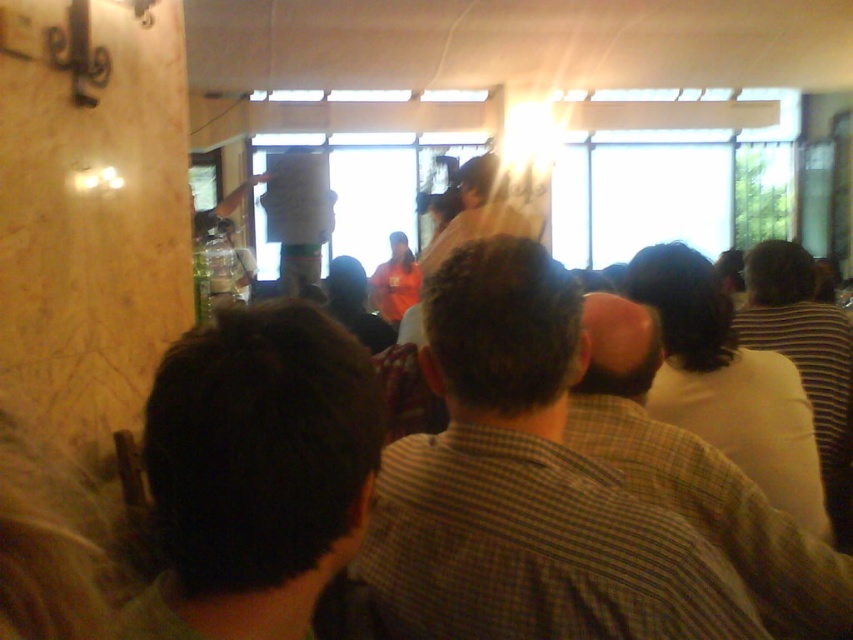
Who is higher up, dark brown hair at center or white shirt at center?

Positioned higher is dark brown hair at center.

Between dark brown hair at center and white shirt at center, which one has more height?

white shirt at center

Is point (180, 577) in front of point (630, 451)?

Yes, it is.

Locate an element on the screen. dark brown hair at center is located at coordinates (254, 472).

Is checkered shirt at center thinner than striped shirt at right?

Yes, checkered shirt at center is thinner than striped shirt at right.

You are a GUI agent. You are given a task and a screenshot of the screen. Output one action in this format:
    pyautogui.click(x=<x>, y=<y>)
    Task: Click on the checkered shirt at center
    
    Given the screenshot: What is the action you would take?
    pyautogui.click(x=525, y=484)

Where is `checkered shirt at center`? checkered shirt at center is located at coordinates (525, 484).

Which is in front, point (514, 637) or point (701, 493)?

Positioned in front is point (514, 637).

Between checkered shirt at center and white shirt at center, which one is positioned higher?

Positioned higher is checkered shirt at center.

Locate an element on the screen. This screenshot has width=853, height=640. checkered shirt at center is located at coordinates (525, 484).